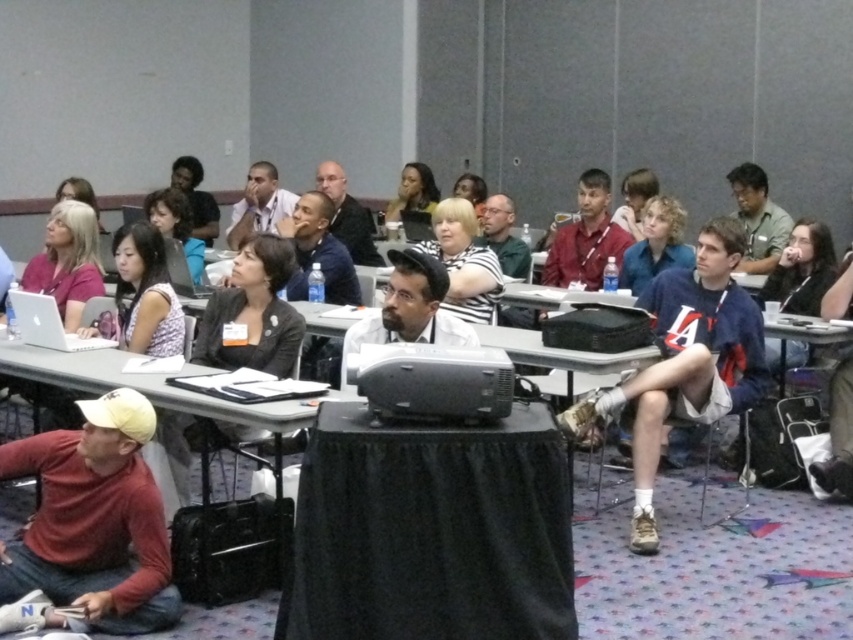
You are an event organizer who needs to move a 3.5 meter long banner from the entrance to the back of the conference room. There is a matte black projector at center and a matte black laptop at center in the way. Can you move the banner through the space between them without bending it?

The distance between the matte black projector at center and the matte black laptop at center is 3.74 meters, which is longer than the 3.5 meter banner. Therefore, the banner can be moved straight through the space between them without bending.

You are organizing a photo shoot and need to arrange two shirts in a display case. The matte red shirt at lower left and the white striped shirt at center must be placed side by side. Which shirt should you place on the left side of the display case to ensure they are arranged from widest to narrowest?

The matte red shirt at lower left should be placed on the left side of the display case since it is wider than the white striped shirt at center, ensuring the arrangement from widest to narrowest.